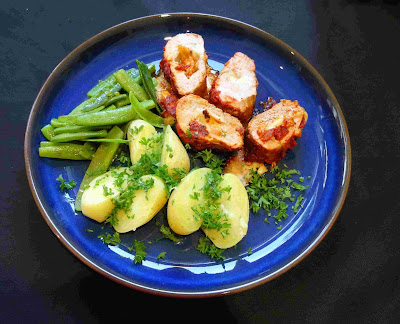
I want to click on bottom of plate, so click(x=193, y=301).